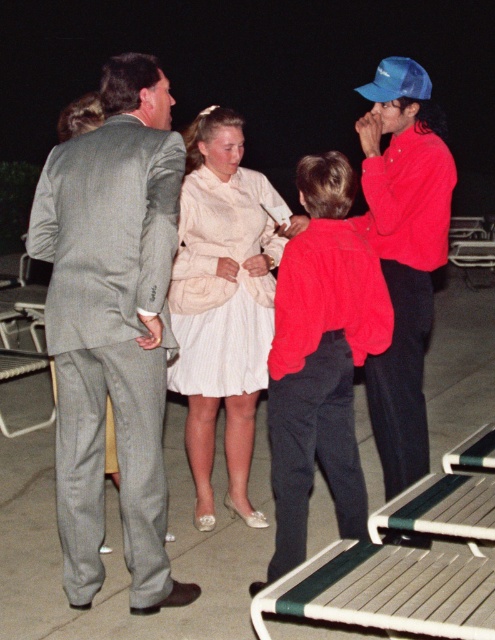
Can you confirm if red fuzzy sweater at center is bigger than blue matte baseball cap at upper right?

Yes, red fuzzy sweater at center is bigger than blue matte baseball cap at upper right.

Is red fuzzy sweater at center thinner than blue matte baseball cap at upper right?

Incorrect, red fuzzy sweater at center's width is not less than blue matte baseball cap at upper right's.

Between point (316, 212) and point (395, 76), which one is positioned behind?

Positioned behind is point (395, 76).

This screenshot has height=640, width=495. I want to click on red fuzzy sweater at center, so click(320, 358).

Who is higher up, gray pinstripe suit at left or white striped fabric dress at center?

white striped fabric dress at center is above.

Between gray pinstripe suit at left and white striped fabric dress at center, which one has more height?

Standing taller between the two is gray pinstripe suit at left.

In order to click on gray pinstripe suit at left in this screenshot , I will do `click(112, 324)`.

Locate an element on the screen. Image resolution: width=495 pixels, height=640 pixels. gray pinstripe suit at left is located at coordinates (112, 324).

Who is higher up, shiny red jacket at right or blue matte baseball cap at upper right?

blue matte baseball cap at upper right is higher up.

Does shiny red jacket at right have a larger size compared to blue matte baseball cap at upper right?

Correct, shiny red jacket at right is larger in size than blue matte baseball cap at upper right.

You are a GUI agent. You are given a task and a screenshot of the screen. Output one action in this format:
    pyautogui.click(x=<x>, y=<y>)
    Task: Click on the shiny red jacket at right
    This screenshot has width=495, height=640.
    Given the screenshot: What is the action you would take?
    pyautogui.click(x=403, y=253)